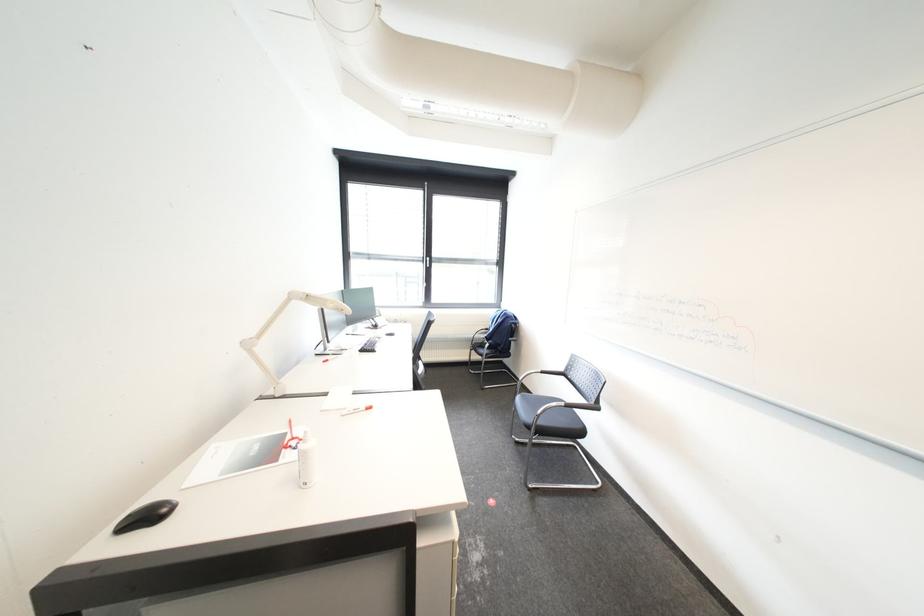
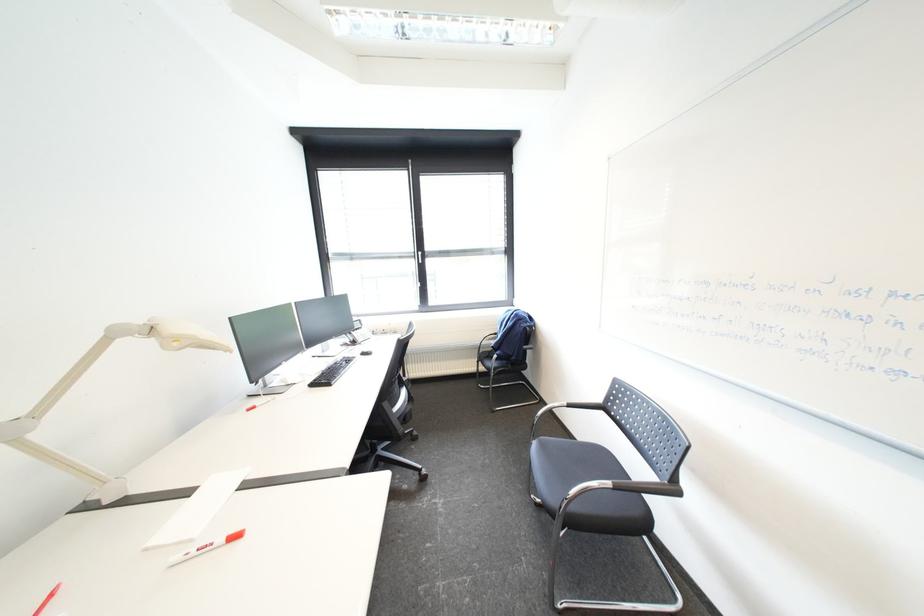
Based on the photo, what movement of the cameraman would produce the second image?

The movement direction of the cameraman is right, forward.